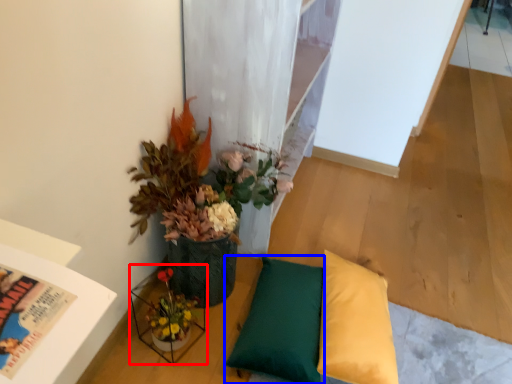
Question: Which object is further to the camera taking this photo, vase (highlighted by a red box) or pillow (highlighted by a blue box)?

Choices:
 (A) vase
 (B) pillow

Answer: (B)